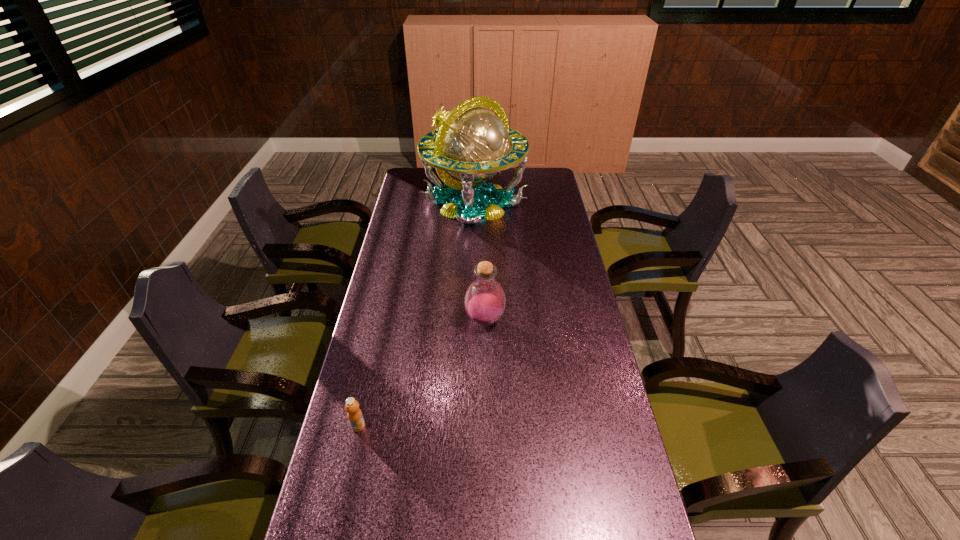
Locate an element on the screen. The width and height of the screenshot is (960, 540). the farthest object is located at coordinates (472, 144).

Image resolution: width=960 pixels, height=540 pixels. In order to click on the tallest object in this screenshot , I will do `click(472, 144)`.

The image size is (960, 540). In order to click on the second nearest object in this screenshot , I will do `click(484, 301)`.

In order to click on bottle in this screenshot , I will do `click(484, 301)`.

Where is `orange juice`? The image size is (960, 540). orange juice is located at coordinates (354, 413).

Identify the location of the shortest object. pyautogui.click(x=354, y=413).

You are a GUI agent. You are given a task and a screenshot of the screen. Output one action in this format:
    pyautogui.click(x=<x>, y=<y>)
    Task: Click on the blank space located 0.340m on the front of the tallest object
    The width and height of the screenshot is (960, 540).
    Given the screenshot: What is the action you would take?
    pyautogui.click(x=472, y=287)

The image size is (960, 540). In order to click on free space located on the right of the second shortest object in this screenshot , I will do 523,320.

Identify the location of vacant space situated on the front label of the nearest object. The image size is (960, 540). (337, 521).

Find the location of a particular element. object at the far edge is located at coordinates (472, 144).